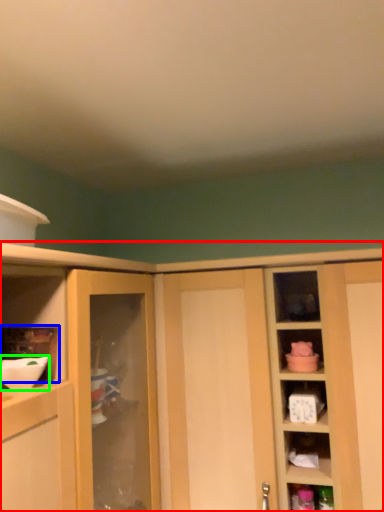
Question: Which object is positioned closest to cabinetry (highlighted by a red box)? Select from shelf (highlighted by a blue box) and mixing bowl (highlighted by a green box).

Choices:
 (A) shelf
 (B) mixing bowl

Answer: (A)